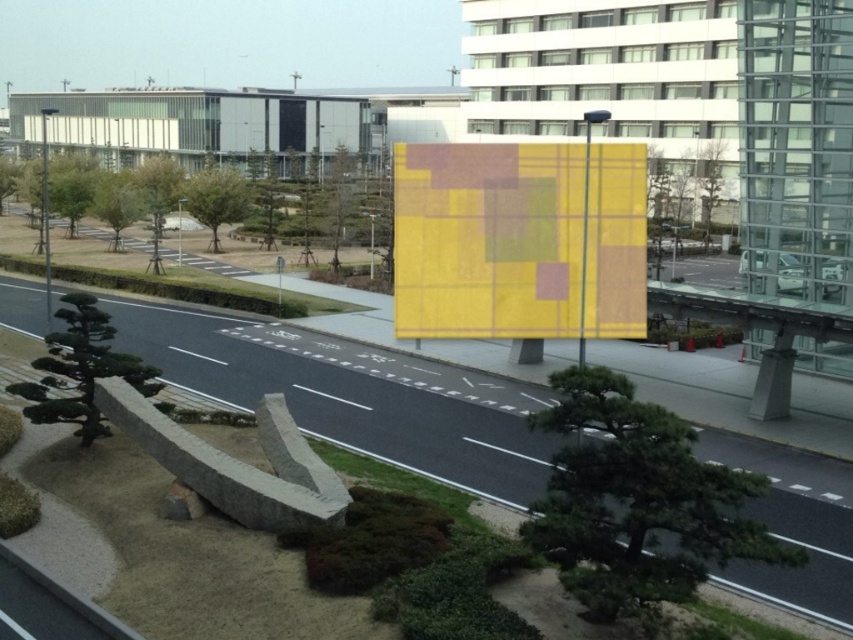
Question: Observing the image, what is the correct spatial positioning of smooth asphalt highway at center in reference to yellow plaid fabric at center?

Choices:
 (A) right
 (B) left

Answer: (B)

Question: Is smooth asphalt highway at center wider than yellow plaid fabric at center?

Choices:
 (A) no
 (B) yes

Answer: (B)

Question: Among these points, which one is farthest from the camera?

Choices:
 (A) tap(480, 396)
 (B) tap(430, 172)

Answer: (B)

Question: Does smooth asphalt highway at center appear under yellow plaid fabric at center?

Choices:
 (A) yes
 (B) no

Answer: (A)